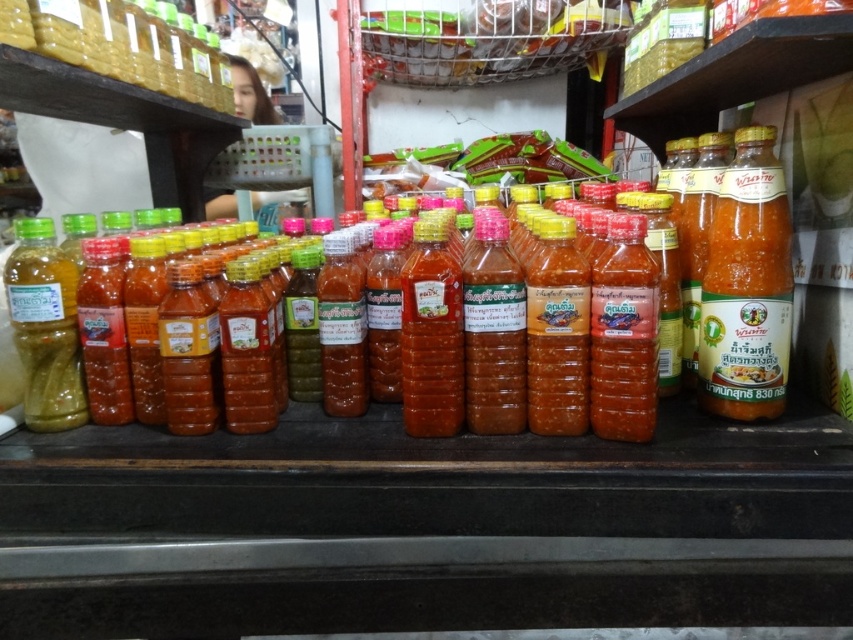
You are a customer in the store looking at the shelf. You want to find the translucent orange sauce at center. Which direction should you look from the point at coordinates point (747, 285)?

The point at coordinates point (747, 285) corresponds to the translucent orange sauce at center, so you are already looking at it.

You are a store employee who needs to place a new bottle of sauce that is 12 inches long between the translucent orange sauce at center and the green matte bottle at left. Is there enough space between them to fit the new bottle?

The distance between the translucent orange sauce at center and the green matte bottle at left is 30.91 inches. Since the new bottle is only 12 inches long, there is sufficient space to place it between them.